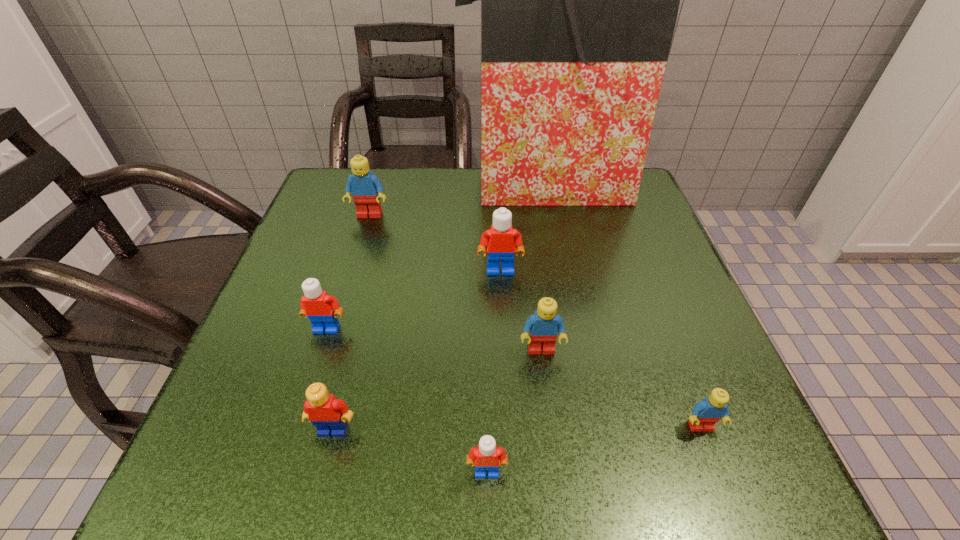
The height and width of the screenshot is (540, 960). Identify the location of the rightmost blue Lego. (706, 413).

The image size is (960, 540). What are the coordinates of `the smallest blue Lego` in the screenshot? It's located at (706, 413).

Locate an element on the screen. This screenshot has height=540, width=960. the nearest Lego is located at coordinates (486, 456).

Image resolution: width=960 pixels, height=540 pixels. What are the coordinates of `the smallest white Lego` in the screenshot? It's located at (486, 456).

What are the coordinates of `vacant space located 0.180m on the front side of the shopping bag` in the screenshot? It's located at pos(559,262).

This screenshot has height=540, width=960. Identify the location of vacant space positioned 0.300m on the face of the farthest blue Lego. (338, 319).

Identify the location of blank space located on the face of the farthest white Lego. (508, 424).

Where is `free space located 0.180m on the face of the fourth farthest Lego`? The height and width of the screenshot is (540, 960). free space located 0.180m on the face of the fourth farthest Lego is located at coordinates (555, 464).

Where is `vacant region located on the face of the second farthest white Lego`? vacant region located on the face of the second farthest white Lego is located at coordinates (317, 358).

Find the location of a particular element. The width and height of the screenshot is (960, 540). shopping bag located in the far edge section of the desktop is located at coordinates (579, 0).